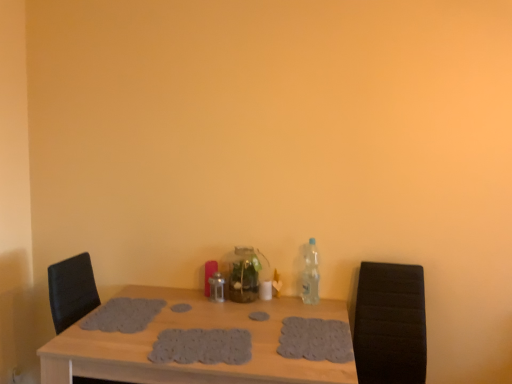
Locate an element on the screen. space that is in front of clear plastic bottle at right, positioned as the second bottle in left-to-right order is located at coordinates (315, 312).